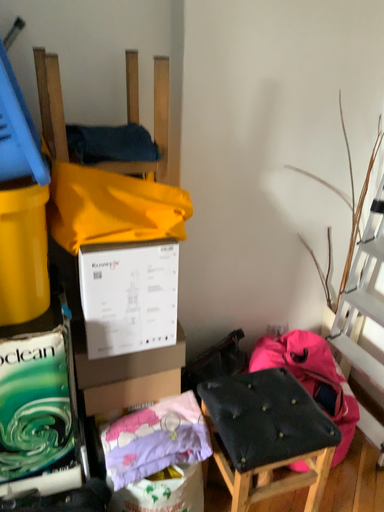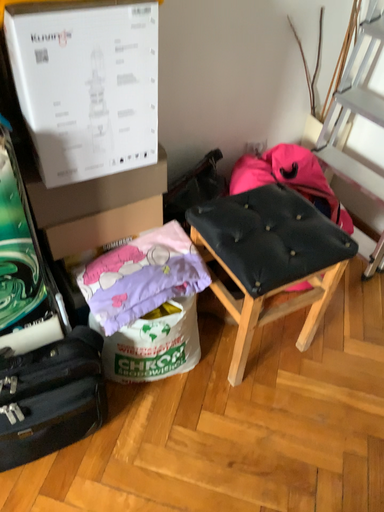
Question: How did the camera likely rotate when shooting the video?

Choices:
 (A) rotated upward
 (B) rotated downward

Answer: (B)